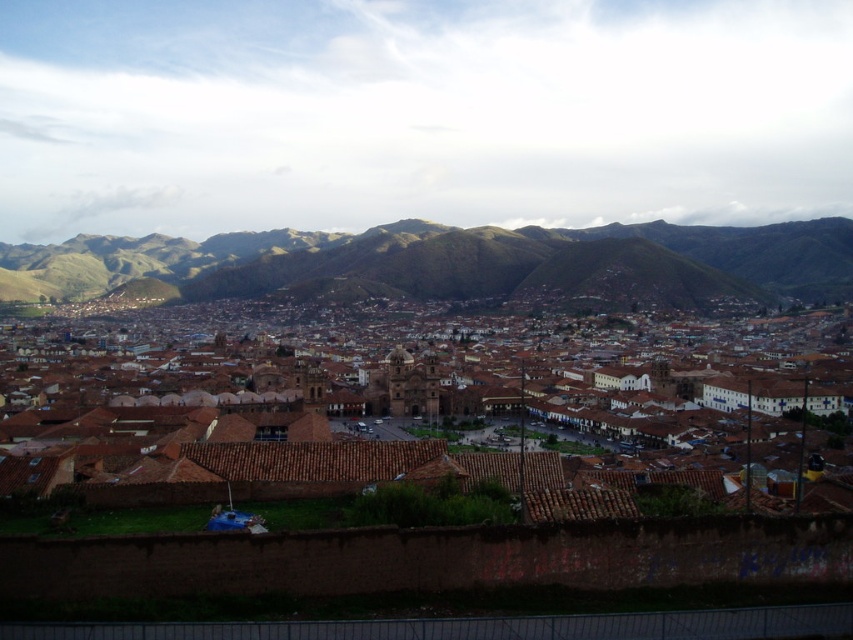
You are standing at a viewpoint overlooking the city and want to take a photo. You notice two points in the scene marked as point 1 at coordinates (321, 417) and point 2 at coordinates (827, 269). Which point is closer to your current position?

Point 1 at coordinates (321, 417) is closer to the camera than point 2 at coordinates (827, 269), so the closer point to your current position is point 1 at coordinates (321, 417).

You are standing at the viewpoint overlooking the city. You notice a point marked at coordinates (434, 448). What does this point indicate?

The point at (434, 448) indicates the location of the brown tile roofs at center.

You are standing at the viewpoint overlooking the city and notice the brown tile roofs at center and the green grassy hill at center. Which of these two landmarks is located to the right when viewed from your current position?

The brown tile roofs at center is positioned on the right side of green grassy hill at center, so when viewed from your current position, the brown tile roofs at center is to the right of the green grassy hill at center.